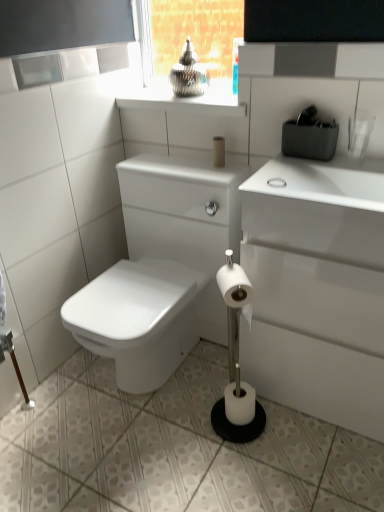
Where is `unoccupied space behind white matte toilet paper at center, which is the second toilet paper in front-to-back order`? unoccupied space behind white matte toilet paper at center, which is the second toilet paper in front-to-back order is located at coordinates (214, 379).